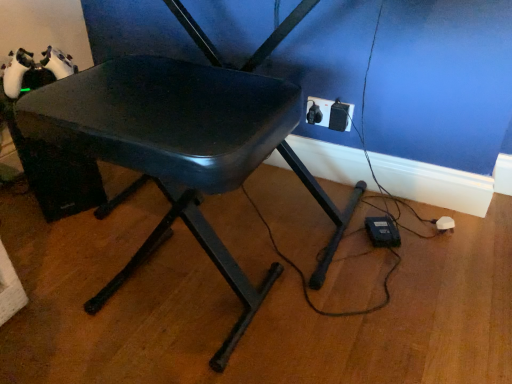
Identify the location of unoccupied region to the right of matte black chair at center. (350, 323).